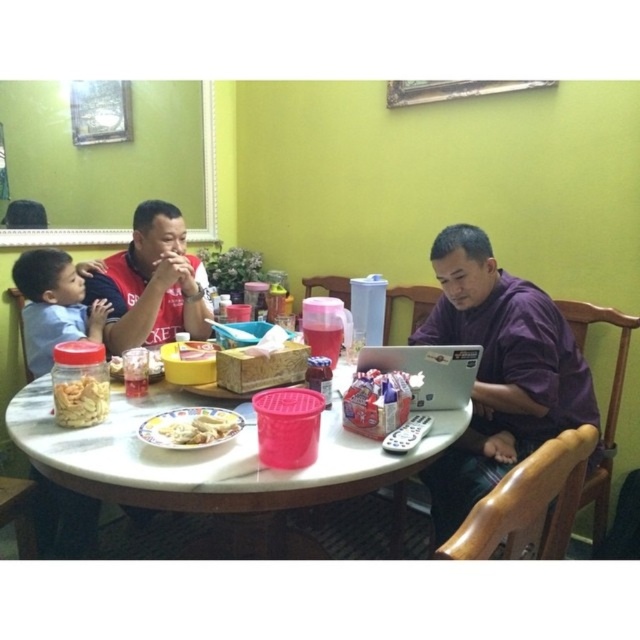
Does purple matte shirt at center have a greater height compared to matte red shirt at center?

Yes.

Does purple matte shirt at center appear under matte red shirt at center?

Correct, purple matte shirt at center is located below matte red shirt at center.

Which is in front, point (490, 400) or point (192, 320)?

Point (490, 400) is more forward.

Where is `purple matte shirt at center`? purple matte shirt at center is located at coordinates point(499,371).

From the picture: Does purple matte shirt at center appear on the right side of translucent glass jar at lower left?

Correct, you'll find purple matte shirt at center to the right of translucent glass jar at lower left.

Is purple matte shirt at center thinner than translucent glass jar at lower left?

Incorrect, purple matte shirt at center's width is not less than translucent glass jar at lower left's.

The width and height of the screenshot is (640, 640). In order to click on purple matte shirt at center in this screenshot , I will do `click(499, 371)`.

Measure the distance between point [500,401] and camera.

A distance of 5.50 feet exists between point [500,401] and camera.

Is point (435, 486) positioned behind point (214, 355)?

That is True.

The height and width of the screenshot is (640, 640). Find the location of `purple matte laptop at center`. purple matte laptop at center is located at coordinates (145, 278).